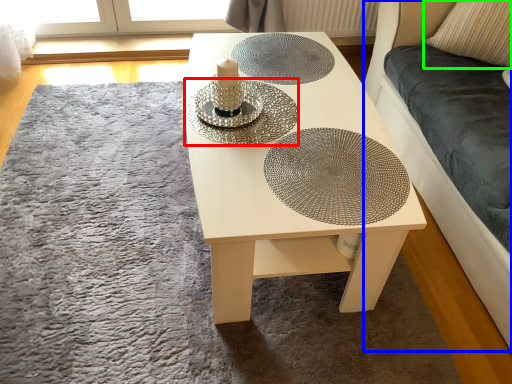
Question: Based on their relative distances, which object is nearer to glass plate (highlighted by a red box)? Choose from couch (highlighted by a blue box) and pillow (highlighted by a green box).

Choices:
 (A) couch
 (B) pillow

Answer: (A)